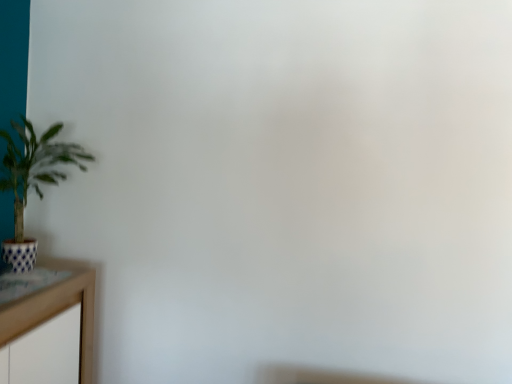
Describe the element at coordinates (32, 180) in the screenshot. I see `green glossy plant at left` at that location.

Find the location of `green glossy plant at left`. green glossy plant at left is located at coordinates (32, 180).

This screenshot has height=384, width=512. What are the coordinates of `green glossy plant at left` in the screenshot? It's located at (32, 180).